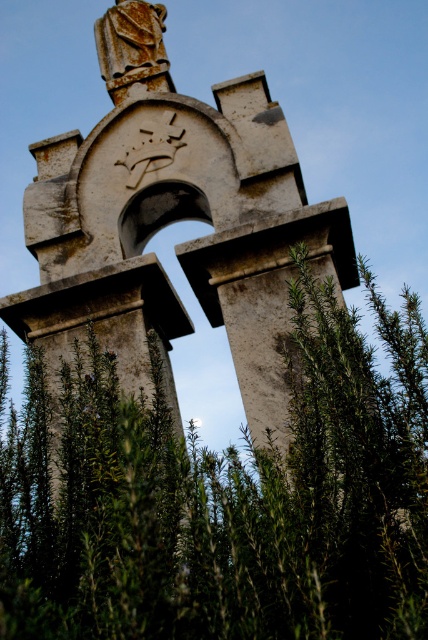
Who is shorter, green leafy plant at center or rusty stone arch at center?

green leafy plant at center is shorter.

Which is in front, point (175, 541) or point (35, 243)?

Point (175, 541) is more forward.

Locate an element on the screen. green leafy plant at center is located at coordinates (225, 497).